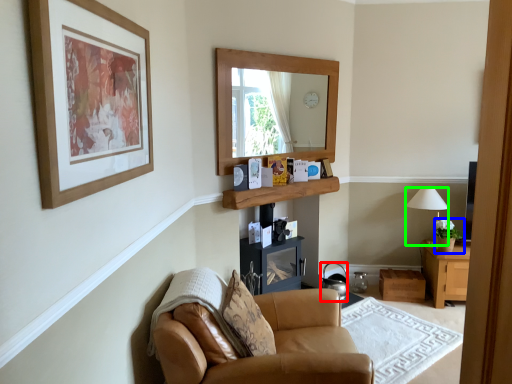
Question: Considering the real-world distances, which object is closest to kettle (highlighted by a red box)? houseplant (highlighted by a blue box) or lamp (highlighted by a green box).

Choices:
 (A) houseplant
 (B) lamp

Answer: (A)